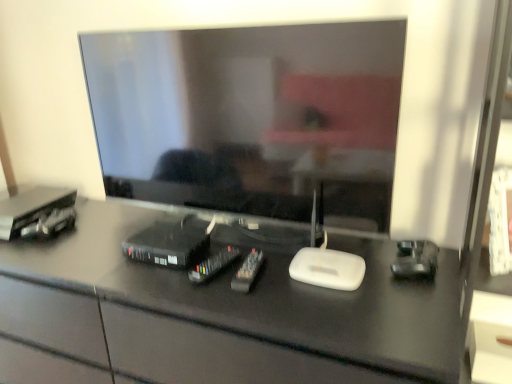
At what (x,y) coordinates should I click in order to perform the action: click on free space in front of black plastic dvd player at lower left, positioned as the 2th equipment in left-to-right order. Please return your answer as a coordinate pair (x, y). Looking at the image, I should click on tap(160, 284).